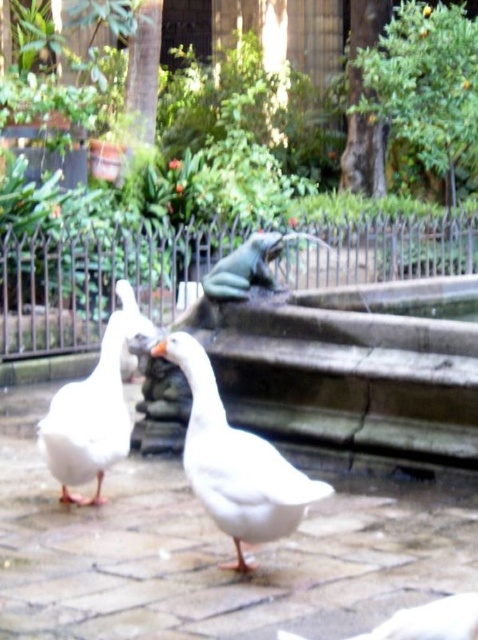
Question: Which object is the farthest from the white matte duck at lower center?

Choices:
 (A) white matte goose at left
 (B) white matte goose at center
 (C) green rubber frog at center
 (D) metallic wire fence at center

Answer: (D)

Question: Can you confirm if metallic wire fence at center is smaller than white matte beak at center?

Choices:
 (A) yes
 (B) no

Answer: (B)

Question: Which object is positioned farthest from the white matte beak at center?

Choices:
 (A) white matte duck at lower center
 (B) green rubber frog at center

Answer: (A)

Question: Does white matte goose at center have a smaller size compared to white matte duck at lower center?

Choices:
 (A) no
 (B) yes

Answer: (A)

Question: Which object appears farthest from the camera in this image?

Choices:
 (A) green rubber frog at center
 (B) white matte beak at center
 (C) white matte goose at left
 (D) white matte duck at lower center

Answer: (A)

Question: From the image, what is the correct spatial relationship of metallic wire fence at center in relation to white matte goose at center?

Choices:
 (A) left
 (B) right

Answer: (A)